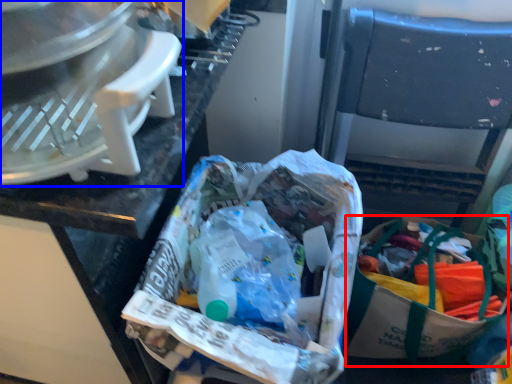
Question: Which of the following is the farthest to the observer, shopping bag (highlighted by a red box) or kitchen appliance (highlighted by a blue box)?

Choices:
 (A) shopping bag
 (B) kitchen appliance

Answer: (A)